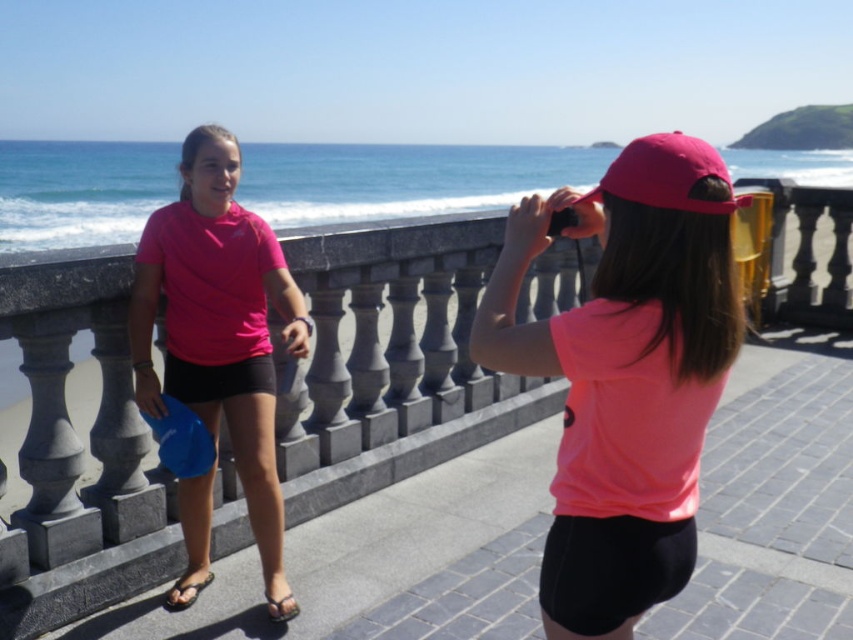
Question: Can you confirm if pink matte shirt at center is positioned above pink matte t-shirt at center?

Choices:
 (A) no
 (B) yes

Answer: (B)

Question: Does pink matte shirt at center appear over pink matte t-shirt at center?

Choices:
 (A) no
 (B) yes

Answer: (B)

Question: Does pink matte shirt at center appear on the left side of pink matte t-shirt at center?

Choices:
 (A) no
 (B) yes

Answer: (A)

Question: Which point is closer to the camera?

Choices:
 (A) (152, 413)
 (B) (593, 314)

Answer: (B)